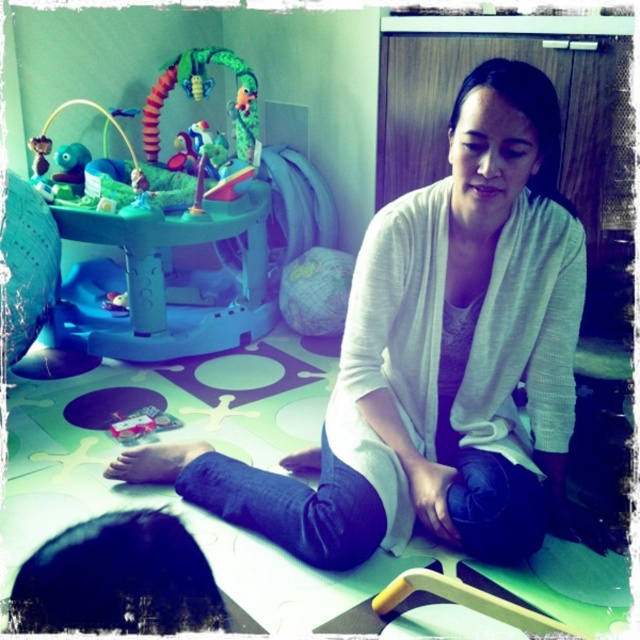
You are a parent trying to decide where to place a new toy. You have a white sweater at center and a teal plastic baby bouncer at upper left. Which object takes up more space in the room?

The teal plastic baby bouncer at upper left takes up more space because it is larger than the white sweater at center.

You are a parent trying to place a new toy on the floor near the white sweater at center. The coordinates of the white sweater at center are given as point (435, 362). If you want to place the toy 0.1 units to the right of this point, what are the new coordinates?

The new coordinates would be 0.566 plus 0.1 in the x direction, so 0.666, 0.681.

You are a parent trying to place a new toy on the floor in the playroom. The toy requires a space that is not occupied by any objects listed below. Based on the image, where can you place the toy so it won not be under or overlapping with the white sweater at center?

The white sweater at center is located at point (435, 362). Since there are no other objects listed, you can place the new toy anywhere else on the floor except near that coordinate.